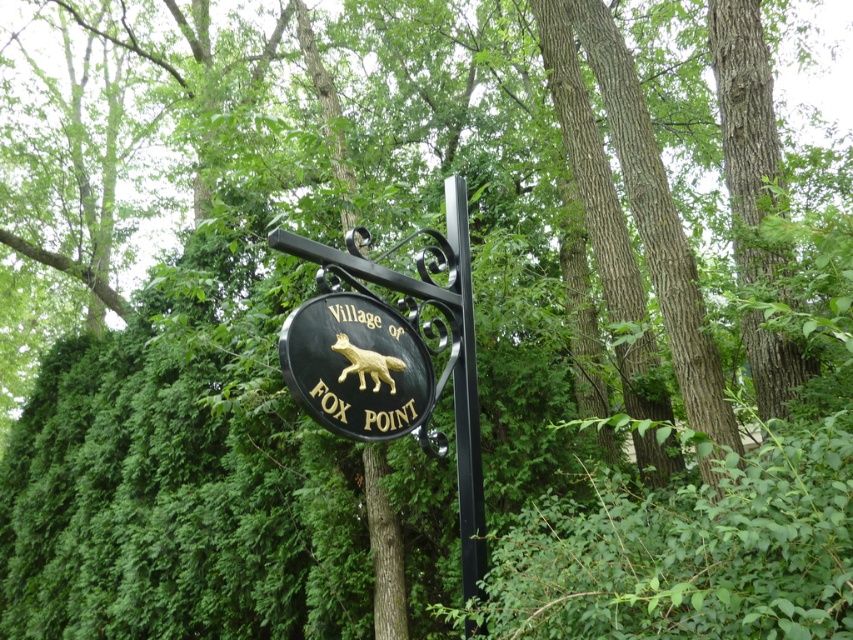
You are a painter standing at the base of the black metal pole at center, looking up at the black polished wood sign at center. Which object is higher from the ground?

The black polished wood sign at center is higher from the ground than the black metal pole at center because it is positioned above it.

You are standing in front of the signpost at the Village of FOX POINT. There is a gold metallic fox emblem located at point (x=392, y=353). If you were to draw a straight line from your current position to this point, would it pass through any other objects on the signpost?

The gold metallic fox at center is located at point (x=392, y=353) on the signpost. Since the sign is circular and the fox is at the center, drawing a straight line from your position to this point would not pass through any other objects on the signpost as the fox is centrally positioned.

You are a painter standing in front of the signpost. You want to paint the scene so that the gold metallic fox at center is clearly visible in front of the black polished wood sign at center. Is this possible given their positions?

The black polished wood sign at center is behind the gold metallic fox at center, so yes, the gold metallic fox at center will naturally appear in front of the black polished wood sign at center, making it clearly visible.